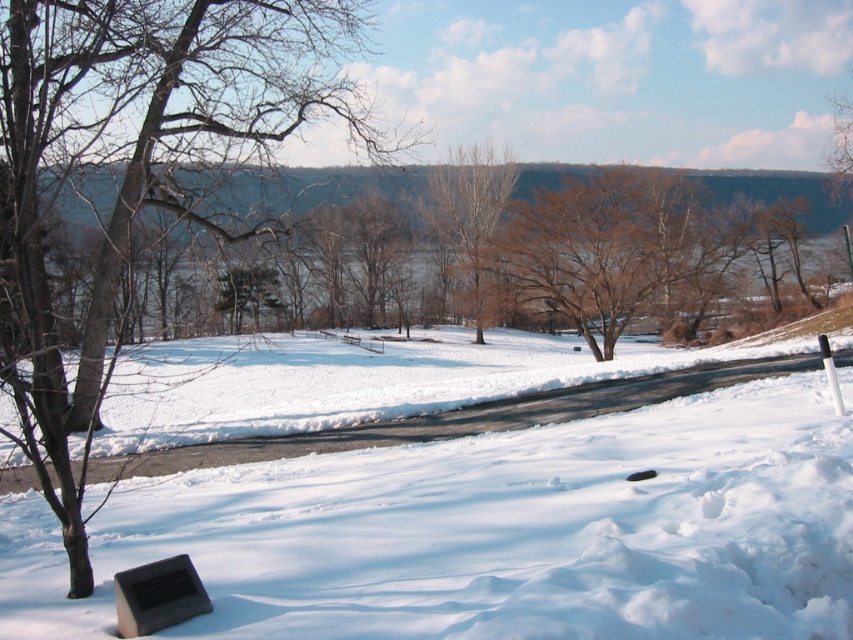
Which of these two, brown/dry wood tree at lower left or brown matte tree at center, stands taller?

brown matte tree at center

I want to click on brown/dry wood tree at lower left, so click(138, 166).

At what (x,y) coordinates should I click in order to perform the action: click on brown/dry wood tree at lower left. Please return your answer as a coordinate pair (x, y). The width and height of the screenshot is (853, 640). Looking at the image, I should click on (138, 166).

Between white fluffy snow at center and black polished stone plaque at lower left, which one has less height?

With less height is black polished stone plaque at lower left.

Does point (572, 566) come in front of point (138, 620)?

No, it is behind (138, 620).

Is point (273, 611) closer to viewer compared to point (189, 576)?

Yes, it is.

This screenshot has height=640, width=853. Identify the location of white fluffy snow at center. (492, 532).

Can you confirm if white fluffy snow at center is positioned to the left of brown/dry wood tree at lower left?

No, white fluffy snow at center is not to the left of brown/dry wood tree at lower left.

Who is more distant from viewer, (653, 413) or (173, 86)?

The point (173, 86) is more distant.

Where is `white fluffy snow at center`? white fluffy snow at center is located at coordinates (492, 532).